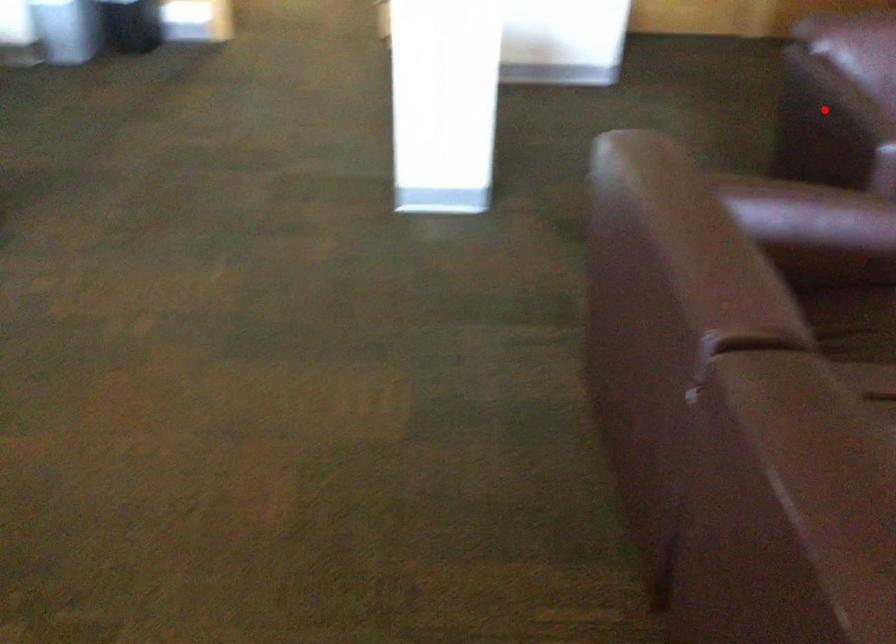
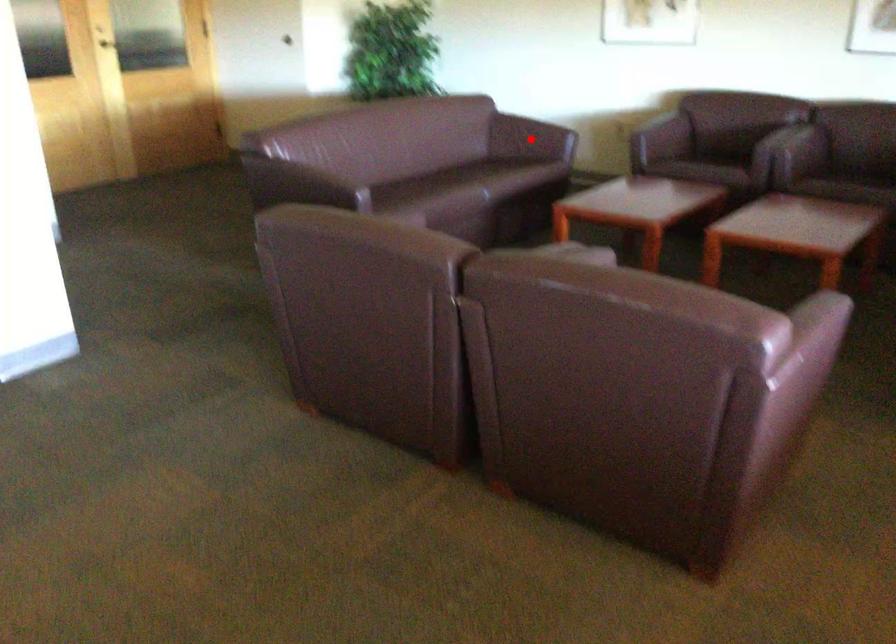
I am providing you with two images of the same scene from different viewpoints. A red point is marked on the first image and another point is marked on the second image. Do the highlighted points in image1 and image2 indicate the same real-world spot?

No